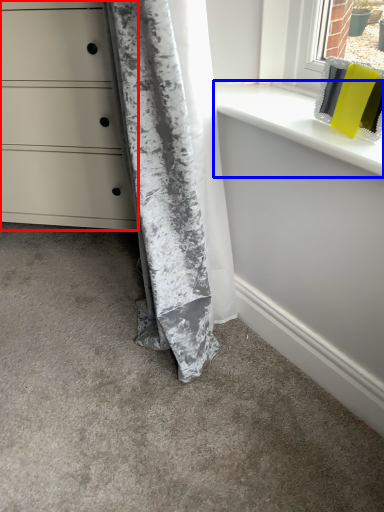
Question: Which point is closer to the camera, chest of drawers (highlighted by a red box) or window sill (highlighted by a blue box)?

Choices:
 (A) chest of drawers
 (B) window sill

Answer: (B)